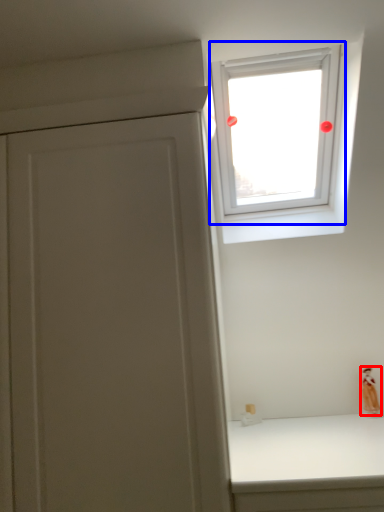
Question: Which point is further to the camera, figurine (highlighted by a red box) or window (highlighted by a blue box)?

Choices:
 (A) figurine
 (B) window

Answer: (A)